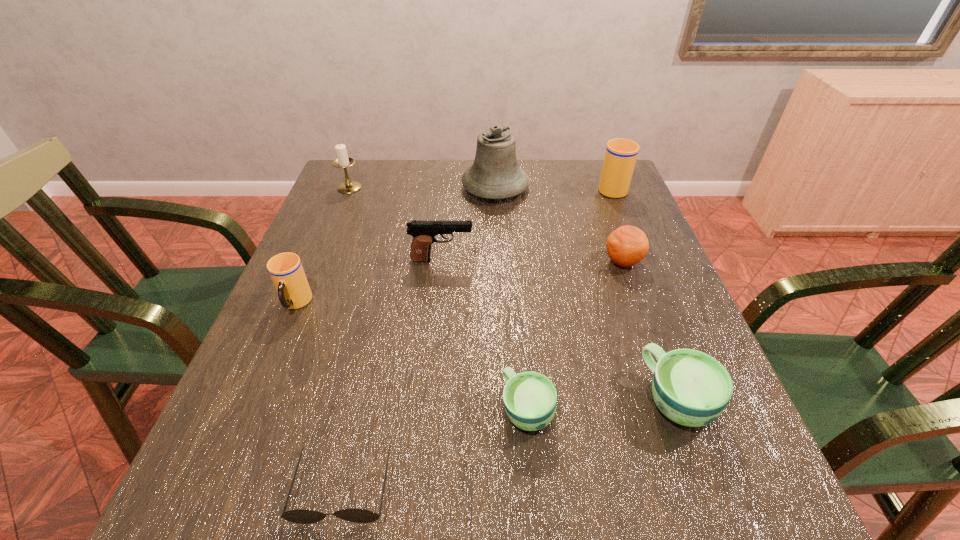
Where is `orange present at the right edge`? The image size is (960, 540). orange present at the right edge is located at coordinates (628, 245).

Image resolution: width=960 pixels, height=540 pixels. What are the coordinates of `object that is at the far left corner` in the screenshot? It's located at (343, 161).

Where is `object that is at the near left corner`? object that is at the near left corner is located at coordinates 299,516.

You are a GUI agent. You are given a task and a screenshot of the screen. Output one action in this format:
    pyautogui.click(x=<x>, y=<y>)
    Task: Click on the object situated at the far right corner
    
    Given the screenshot: What is the action you would take?
    pyautogui.click(x=621, y=154)

The image size is (960, 540). Find the location of `vacant area at the far edge of the desktop`. vacant area at the far edge of the desktop is located at coordinates (435, 192).

This screenshot has width=960, height=540. In the image, there is a desktop. Find the location of `vacant space at the near edge`. vacant space at the near edge is located at coordinates (348, 482).

Where is `vacant space at the left edge of the desktop`? This screenshot has height=540, width=960. vacant space at the left edge of the desktop is located at coordinates (269, 379).

In the image, there is a desktop. Where is `blank space at the right edge`? blank space at the right edge is located at coordinates (662, 337).

The width and height of the screenshot is (960, 540). In the image, there is a desktop. What are the coordinates of `vacant space at the far left corner` in the screenshot? It's located at (381, 159).

Locate an element on the screen. The image size is (960, 540). free space at the far right corner is located at coordinates (576, 165).